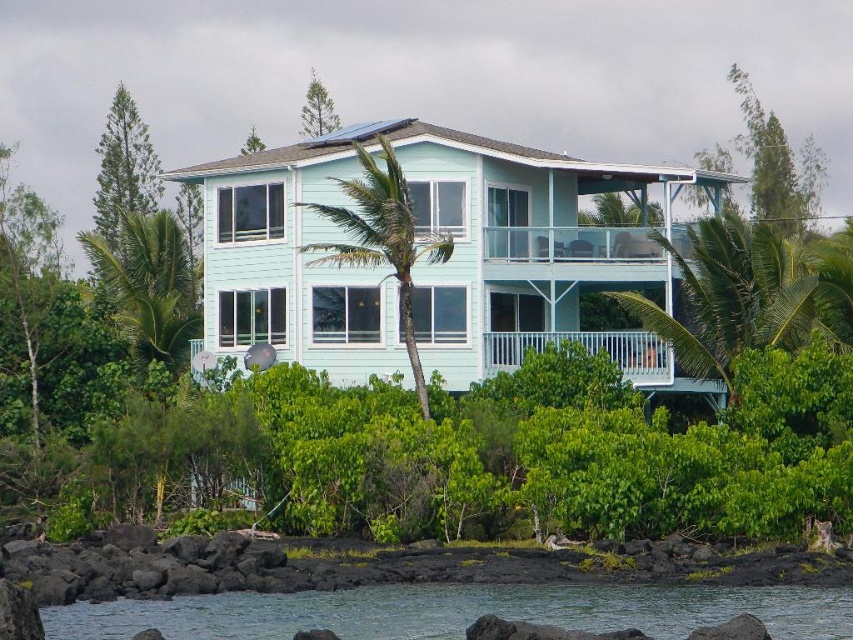
Who is taller, green leafy palm tree at right or green leafy palm tree at left?

With more height is green leafy palm tree at left.

Does green leafy palm tree at right have a lesser height compared to green leafy palm tree at left?

Indeed, green leafy palm tree at right has a lesser height compared to green leafy palm tree at left.

Between point (650, 323) and point (180, 356), which one is positioned behind?

Positioned behind is point (180, 356).

This screenshot has height=640, width=853. I want to click on green leafy palm tree at right, so click(750, 294).

Is green leafy palm tree at right thinner than green leafy palm tree at center?

No.

Does green leafy palm tree at right come in front of green leafy palm tree at center?

No, it is not.

Does point (691, 272) come in front of point (387, 177)?

No.

The height and width of the screenshot is (640, 853). I want to click on green leafy palm tree at right, so click(750, 294).

Which is above, green leafy palm tree at center or green leafy palm tree at left?

green leafy palm tree at left is higher up.

Can you confirm if green leafy palm tree at center is positioned below green leafy palm tree at left?

Yes, green leafy palm tree at center is below green leafy palm tree at left.

What do you see at coordinates (381, 237) in the screenshot? The height and width of the screenshot is (640, 853). I see `green leafy palm tree at center` at bounding box center [381, 237].

Where is `green leafy palm tree at center`? Image resolution: width=853 pixels, height=640 pixels. green leafy palm tree at center is located at coordinates (381, 237).